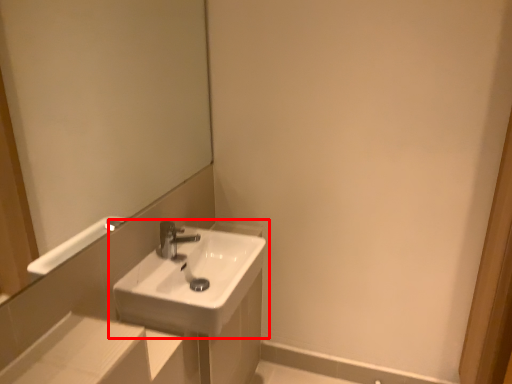
Question: From the image's perspective, what is the correct spatial relationship of sink (annotated by the red box) in relation to mirror?

Choices:
 (A) below
 (B) above

Answer: (A)